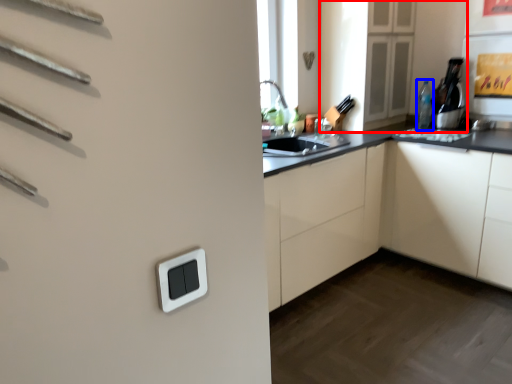
Question: Which point is further to the camera, cabinetry (highlighted by a red box) or bottle (highlighted by a blue box)?

Choices:
 (A) cabinetry
 (B) bottle

Answer: (B)